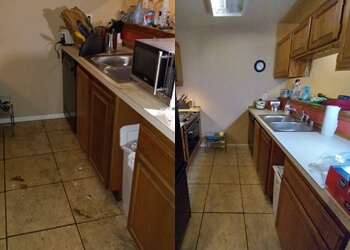
This screenshot has width=350, height=250. I want to click on wall clock, so click(259, 69).